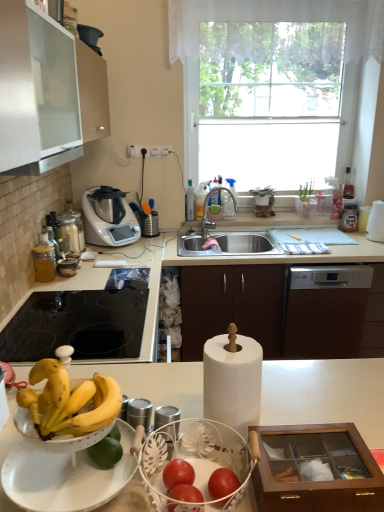
The height and width of the screenshot is (512, 384). I want to click on vacant area that is in front of metallic silver blender at upper right, the first appliance viewed from the left, so click(359, 234).